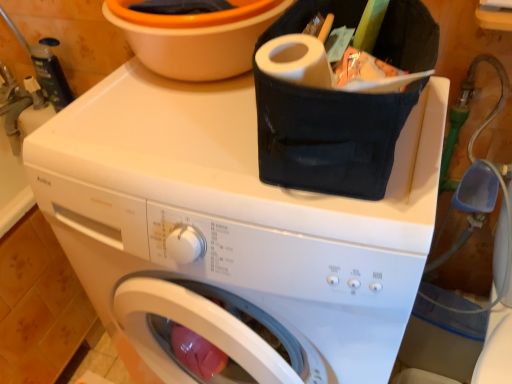
Question: Is the position of orange plastic basin at upper center less distant than that of white matte washing machine at upper center?

Choices:
 (A) no
 (B) yes

Answer: (A)

Question: Is orange plastic basin at upper center not inside white matte washing machine at upper center?

Choices:
 (A) yes
 (B) no

Answer: (A)

Question: Considering the relative sizes of orange plastic basin at upper center and white matte washing machine at upper center in the image provided, is orange plastic basin at upper center shorter than white matte washing machine at upper center?

Choices:
 (A) no
 (B) yes

Answer: (B)

Question: Is orange plastic basin at upper center thinner than white matte washing machine at upper center?

Choices:
 (A) yes
 (B) no

Answer: (A)

Question: Can you confirm if orange plastic basin at upper center is wider than white matte washing machine at upper center?

Choices:
 (A) no
 (B) yes

Answer: (A)

Question: From a real-world perspective, is orange plastic basin at upper center on top of white matte washing machine at upper center?

Choices:
 (A) no
 (B) yes

Answer: (B)

Question: Is white matte washing machine at upper center far from orange plastic basin at upper center?

Choices:
 (A) yes
 (B) no

Answer: (B)

Question: From the image's perspective, would you say white matte washing machine at upper center is positioned over orange plastic basin at upper center?

Choices:
 (A) yes
 (B) no

Answer: (B)

Question: Is orange plastic basin at upper center at the back of white matte washing machine at upper center?

Choices:
 (A) no
 (B) yes

Answer: (A)

Question: Considering the relative sizes of white matte washing machine at upper center and orange plastic basin at upper center in the image provided, is white matte washing machine at upper center smaller than orange plastic basin at upper center?

Choices:
 (A) no
 (B) yes

Answer: (A)

Question: Does white matte washing machine at upper center lie behind orange plastic basin at upper center?

Choices:
 (A) yes
 (B) no

Answer: (B)

Question: From a real-world perspective, is white matte washing machine at upper center under orange plastic basin at upper center?

Choices:
 (A) no
 (B) yes

Answer: (B)

Question: Is point (137, 51) positioned closer to the camera than point (111, 195)?

Choices:
 (A) closer
 (B) farther

Answer: (B)